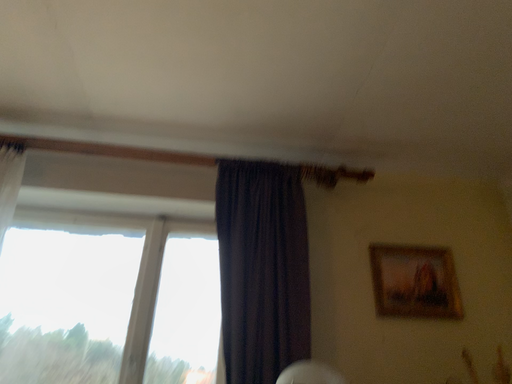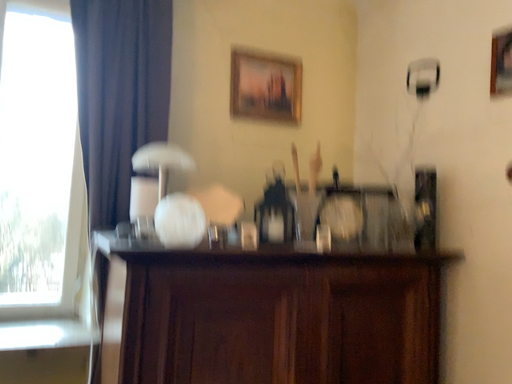
Question: How did the camera likely rotate when shooting the video?

Choices:
 (A) rotated upward
 (B) rotated downward

Answer: (B)